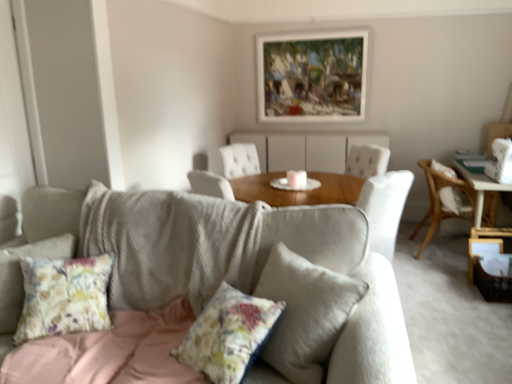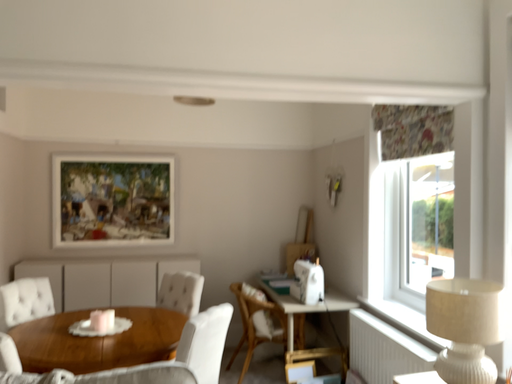
Question: How did the camera likely rotate when shooting the video?

Choices:
 (A) rotated left
 (B) rotated right

Answer: (B)